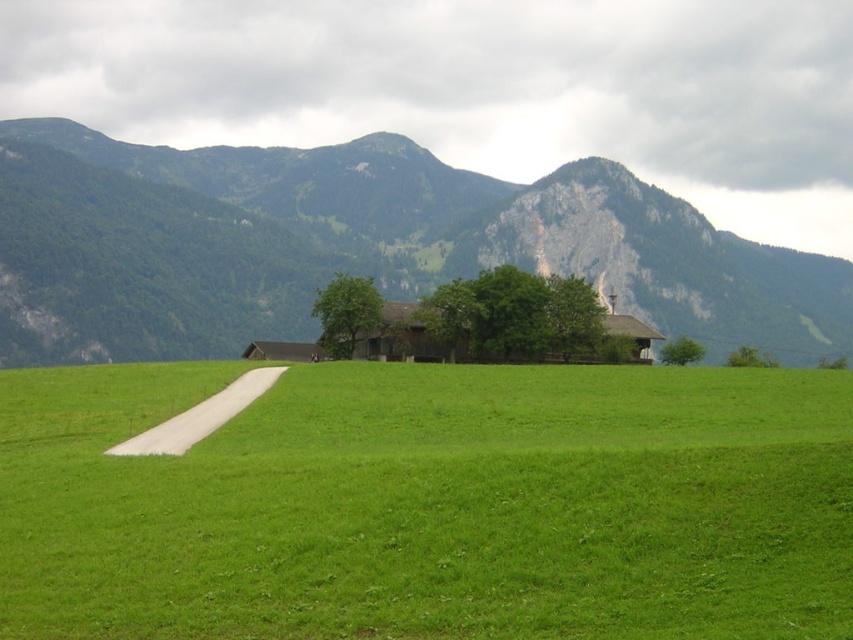
Between green grassy field at lower center and white concrete path at lower left, which one is positioned lower?

white concrete path at lower left is lower down.

At what (x,y) coordinates should I click in order to perform the action: click on green grassy field at lower center. Please return your answer as a coordinate pair (x, y). The height and width of the screenshot is (640, 853). Looking at the image, I should click on (387, 237).

Between green grassy pasture at center and green grassy field at lower center, which one is positioned lower?

green grassy pasture at center

Which is more to the left, green grassy pasture at center or green grassy field at lower center?

From the viewer's perspective, green grassy field at lower center appears more on the left side.

This screenshot has width=853, height=640. Describe the element at coordinates (430, 504) in the screenshot. I see `green grassy pasture at center` at that location.

The width and height of the screenshot is (853, 640). Find the location of `green grassy pasture at center`. green grassy pasture at center is located at coordinates (430, 504).

Can you confirm if green grassy pasture at center is shorter than white concrete path at lower left?

Incorrect, green grassy pasture at center's height does not fall short of white concrete path at lower left's.

Does green grassy pasture at center have a greater height compared to white concrete path at lower left?

Indeed, green grassy pasture at center has a greater height compared to white concrete path at lower left.

Find the location of a particular element. This screenshot has height=640, width=853. green grassy pasture at center is located at coordinates (430, 504).